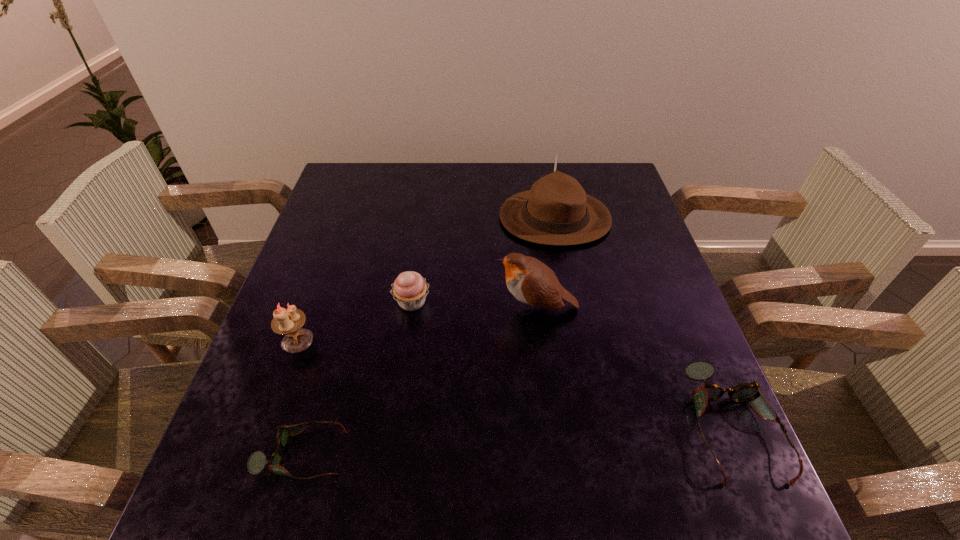
Locate an element on the screen. This screenshot has width=960, height=540. candle holder that is at the left edge is located at coordinates (289, 322).

Where is `spectacles that is at the right edge`? The height and width of the screenshot is (540, 960). spectacles that is at the right edge is located at coordinates (699, 370).

Find the location of `fedora present at the right edge`. fedora present at the right edge is located at coordinates (556, 211).

The width and height of the screenshot is (960, 540). I want to click on object that is at the near left corner, so click(x=257, y=461).

Where is `object that is at the far right corner`? object that is at the far right corner is located at coordinates (556, 211).

This screenshot has height=540, width=960. I want to click on object present at the near right corner, so click(x=699, y=370).

This screenshot has height=540, width=960. In order to click on free region at the far edge of the desktop in this screenshot , I will do `click(498, 192)`.

Where is `free spot at the near edge of the desktop`? The image size is (960, 540). free spot at the near edge of the desktop is located at coordinates (625, 453).

Where is `vacant area at the left edge`? The image size is (960, 540). vacant area at the left edge is located at coordinates (340, 253).

Identify the location of free space at the right edge. tap(630, 248).